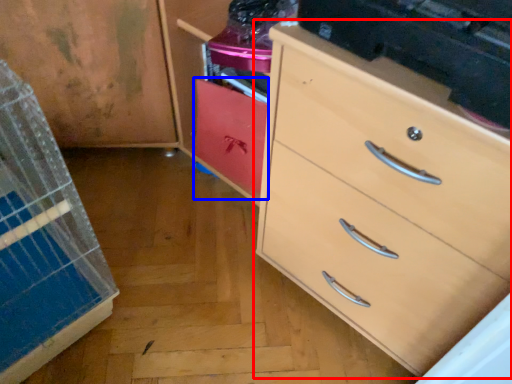
Question: Which point is closer to the camera, chest of drawers (highlighted by a red box) or cabinetry (highlighted by a blue box)?

Choices:
 (A) chest of drawers
 (B) cabinetry

Answer: (A)